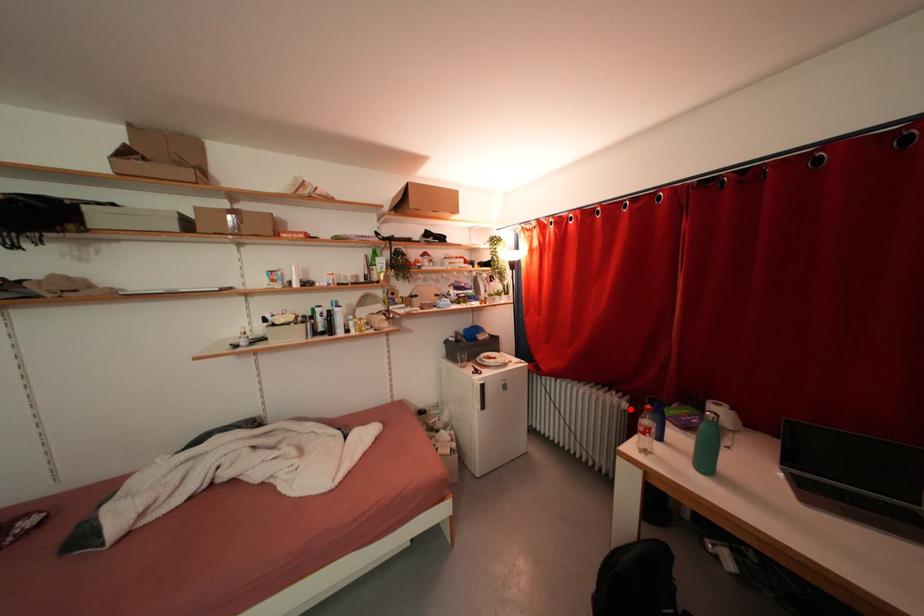
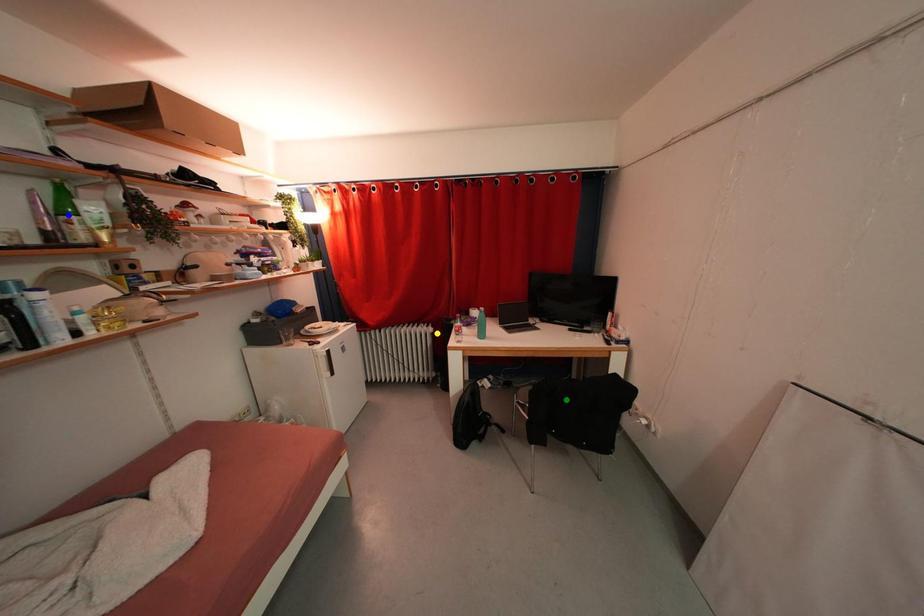
Question: I am providing you with two images of the same scene from different viewpoints. A red point is marked on the first image. You are given multiple points on the second image. Which mark in image 2 goes with the point in image 1?

Choices:
 (A) green point
 (B) blue point
 (C) yellow point

Answer: (C)